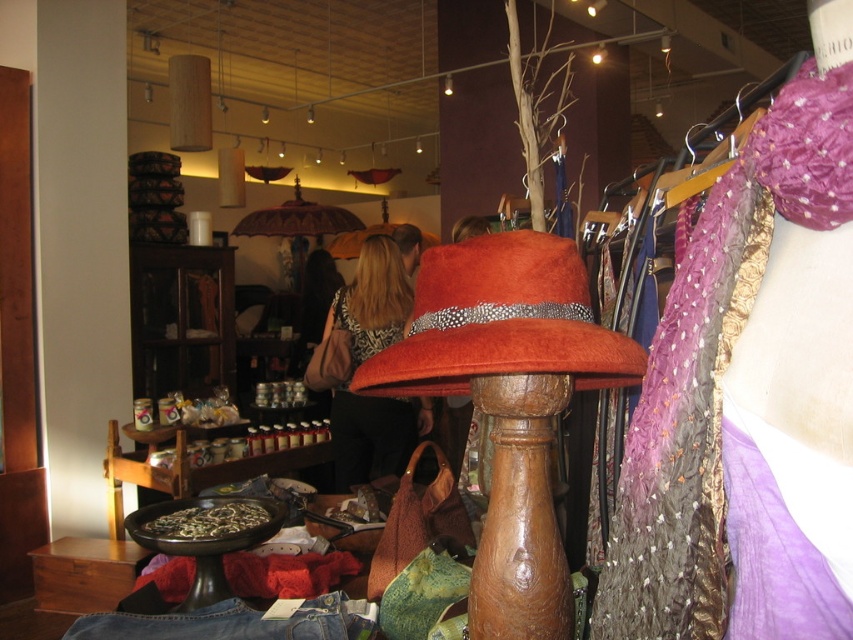
Question: Is orange felt hat at center thinner than matte black dress at center?

Choices:
 (A) no
 (B) yes

Answer: (B)

Question: In this image, where is orange felt hat at center located relative to matte black dress at center?

Choices:
 (A) right
 (B) left

Answer: (A)

Question: Which point is farther to the camera?

Choices:
 (A) matte black dress at center
 (B) orange felt hat at center

Answer: (A)

Question: Among these points, which one is farthest from the camera?

Choices:
 (A) (569, 289)
 (B) (373, 252)

Answer: (B)

Question: Among these objects, which one is nearest to the camera?

Choices:
 (A) orange felt hat at center
 (B) matte black dress at center

Answer: (A)

Question: Is orange felt hat at center to the right of matte black dress at center from the viewer's perspective?

Choices:
 (A) yes
 (B) no

Answer: (A)